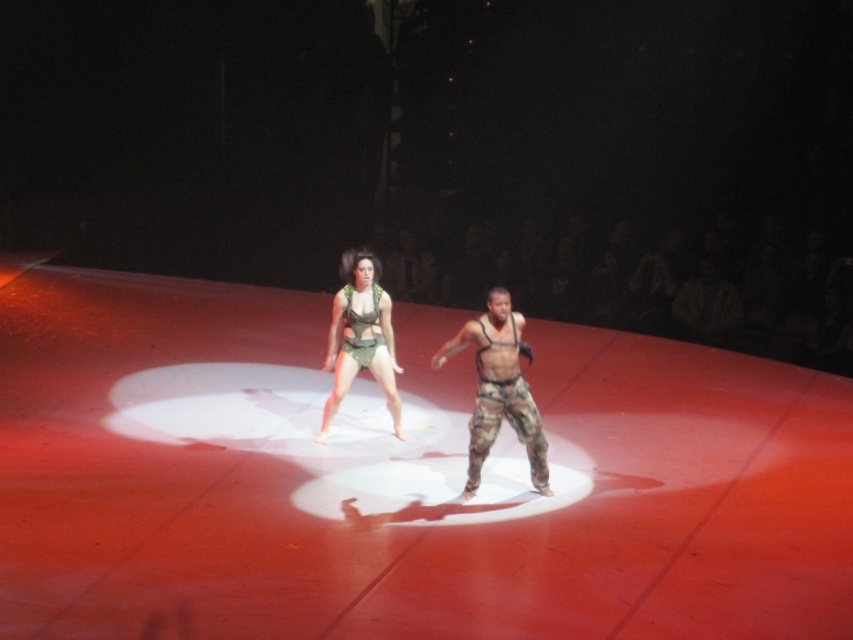
Can you confirm if camouflage pants at center is shorter than green fabric harness at center?

Answer: Correct, camouflage pants at center is not as tall as green fabric harness at center.

Does camouflage pants at center lie in front of green fabric harness at center?

Yes, camouflage pants at center is in front of green fabric harness at center.

Is point (496, 292) closer to viewer compared to point (363, 316)?

Yes, point (496, 292) is in front of point (363, 316).

Find the location of a particular element. camouflage pants at center is located at coordinates (498, 388).